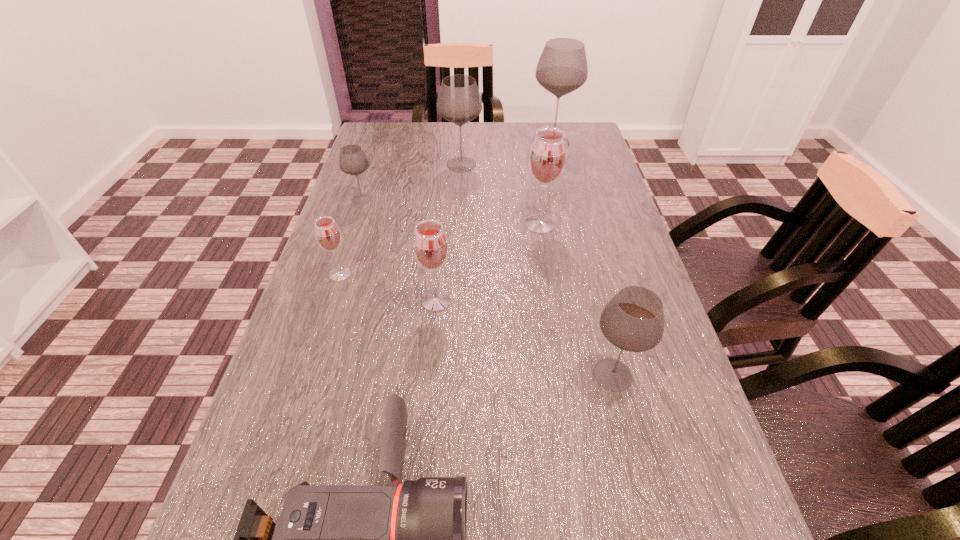
Identify the location of the second nearest red wineglass. (328, 236).

Identify the location of the third farthest wineglass. The image size is (960, 540). (352, 160).

Image resolution: width=960 pixels, height=540 pixels. What are the coordinates of `the leftmost gray wineglass` in the screenshot? It's located at (352, 160).

Image resolution: width=960 pixels, height=540 pixels. What are the coordinates of `vacant space located on the front of the biggest gray wineglass` in the screenshot? It's located at (567, 202).

At what (x,y) coordinates should I click in order to perform the action: click on blank space located 0.080m on the right of the second biggest gray wineglass. Please return your answer as a coordinate pair (x, y). Looking at the image, I should click on (508, 165).

Locate an element on the screen. This screenshot has width=960, height=540. free point located 0.140m on the right of the biggest red wineglass is located at coordinates (612, 224).

The width and height of the screenshot is (960, 540). Find the location of `vacant space situated 0.100m on the back of the second red wineglass from left to right`. vacant space situated 0.100m on the back of the second red wineglass from left to right is located at coordinates (441, 258).

Image resolution: width=960 pixels, height=540 pixels. I want to click on free point located on the left of the nearest gray wineglass, so click(x=468, y=375).

The image size is (960, 540). Identify the location of vacant space positioned 0.210m on the front of the smallest red wineglass. (312, 361).

At what (x,y) coordinates should I click in order to perform the action: click on vacant space situated 0.300m on the right of the smallest gray wineglass. Please return your answer as a coordinate pair (x, y). The width and height of the screenshot is (960, 540). Looking at the image, I should click on (483, 199).